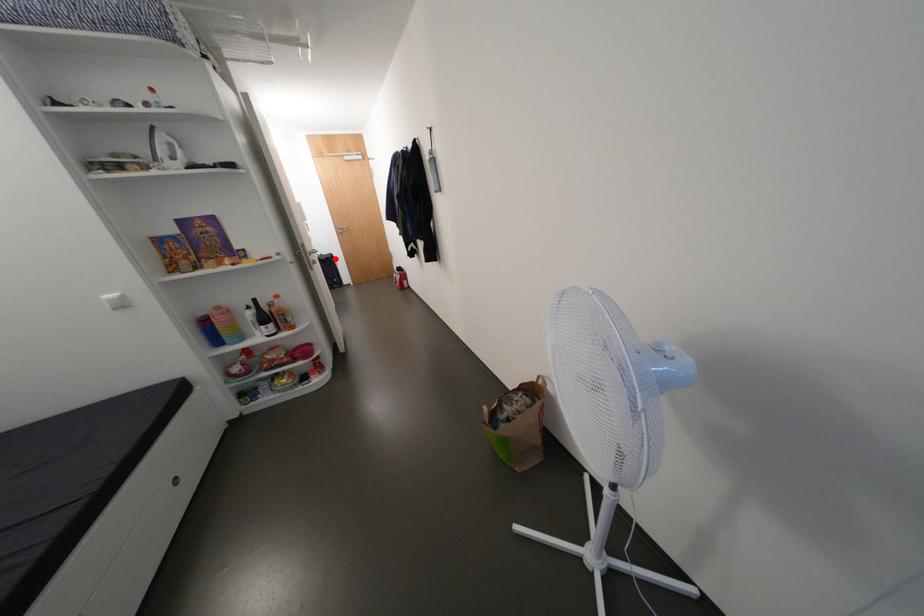
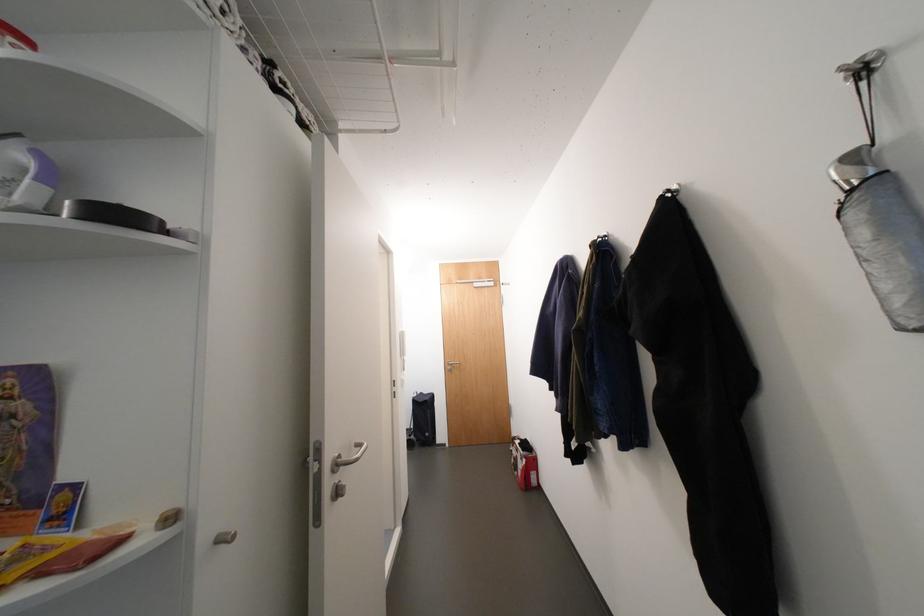
Question: I am providing you with two images of the same scene from different viewpoints. Given a red point in image1, look at the same physical point in image2. Is it:

Choices:
 (A) Closer to the viewpoint
 (B) Farther from the viewpoint

Answer: (B)